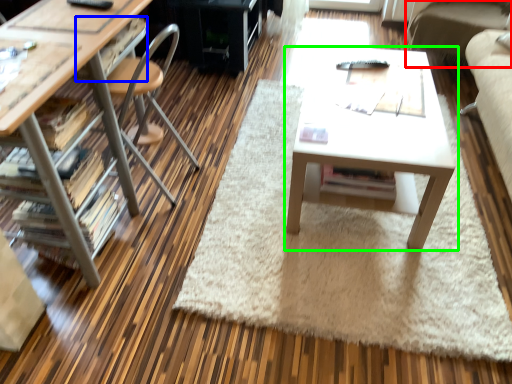
Question: Considering the real-world distances, which object is farthest from couch (highlighted by a red box)? drawer (highlighted by a blue box) or table (highlighted by a green box)?

Choices:
 (A) drawer
 (B) table

Answer: (A)